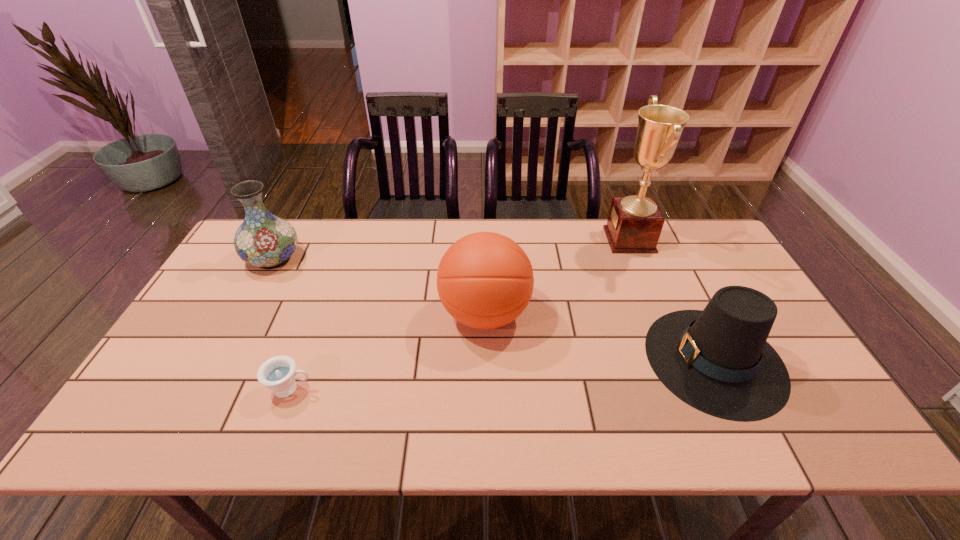
Identify the location of vacant area between the trophy cup and the third object from right to left. The width and height of the screenshot is (960, 540). (557, 277).

Where is `vacant space that's between the third object from right to left and the shortest object`? The height and width of the screenshot is (540, 960). vacant space that's between the third object from right to left and the shortest object is located at coordinates (388, 352).

Where is `vacant point located between the third object from left to right and the second shortest object`? vacant point located between the third object from left to right and the second shortest object is located at coordinates (600, 336).

You are a GUI agent. You are given a task and a screenshot of the screen. Output one action in this format:
    pyautogui.click(x=<x>, y=<y>)
    Task: Click on the second closest object to the tallest object
    This screenshot has width=960, height=540.
    Given the screenshot: What is the action you would take?
    pyautogui.click(x=485, y=280)

Identify the location of the second closest object relative to the basketball. (278, 374).

Image resolution: width=960 pixels, height=540 pixels. Identify the location of vacant space that satisfies the following two spatial constraints: 1. on the front side of the vase; 2. on the right side of the third object from left to right. (243, 314).

I want to click on free point that satisfies the following two spatial constraints: 1. on the plaque of the trophy cup; 2. on the front side of the leftmost object, so click(637, 258).